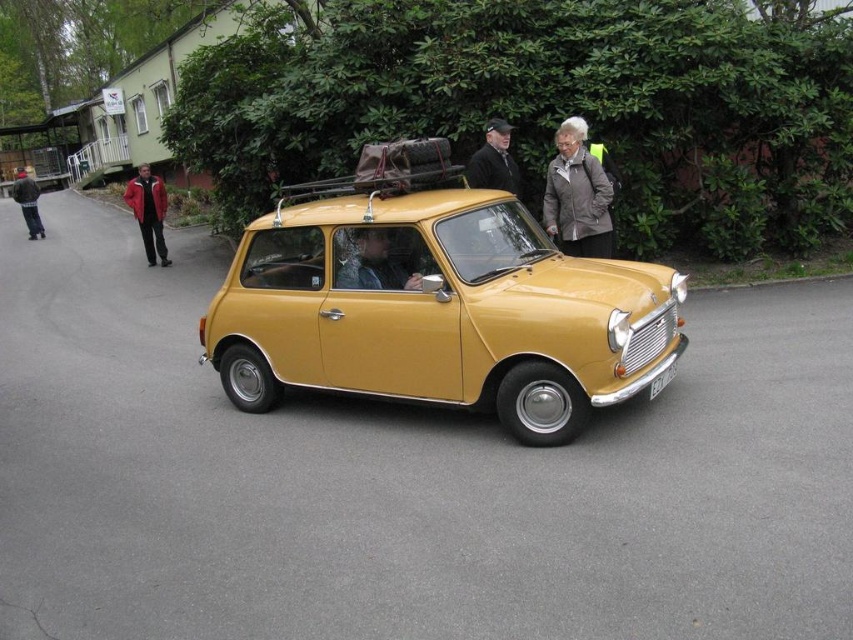
Does matte black jacket at center lie behind red jacket at left?

No, matte black jacket at center is in front of red jacket at left.

Does matte black jacket at center have a lesser width compared to red jacket at left?

Indeed, matte black jacket at center has a lesser width compared to red jacket at left.

What do you see at coordinates (378, 259) in the screenshot? I see `matte black jacket at center` at bounding box center [378, 259].

Locate an element on the screen. Image resolution: width=853 pixels, height=640 pixels. matte black jacket at center is located at coordinates (378, 259).

Find the location of a particular element. The image size is (853, 640). matte gray jacket at center is located at coordinates (577, 195).

Which is behind, point (570, 236) or point (405, 227)?

Positioned behind is point (570, 236).

Does point (589, 230) come farther from viewer compared to point (372, 250)?

Yes, it is behind point (372, 250).

You are a GUI agent. You are given a task and a screenshot of the screen. Output one action in this format:
    pyautogui.click(x=<x>, y=<y>)
    Task: Click on the matte gray jacket at center
    
    Given the screenshot: What is the action you would take?
    pyautogui.click(x=577, y=195)

Does matte gray jacket at center have a greater width compared to white plastic license plate at center?

Indeed, matte gray jacket at center has a greater width compared to white plastic license plate at center.

Is the position of matte gray jacket at center less distant than that of white plastic license plate at center?

No, it is behind white plastic license plate at center.

Between point (582, 237) and point (670, 364), which one is positioned behind?

The point (582, 237) is more distant.

Where is `matte gray jacket at center`? matte gray jacket at center is located at coordinates (577, 195).